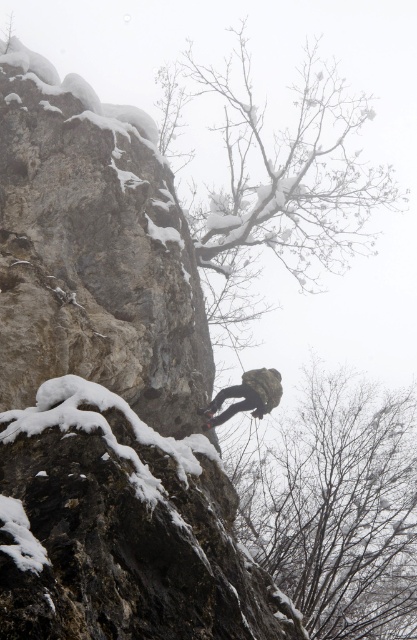
What do you see at coordinates (336, 508) in the screenshot? The height and width of the screenshot is (640, 417). I see `bare branches at center` at bounding box center [336, 508].

Is bare branches at center to the left of snow-covered branches at upper center from the viewer's perspective?

Incorrect, bare branches at center is not on the left side of snow-covered branches at upper center.

Does point (391, 500) lie behind point (168, 125)?

No, it is in front of (168, 125).

Find the location of a particular element. Image resolution: width=417 pixels, height=640 pixels. bare branches at center is located at coordinates (336, 508).

Does snow-covered branches at upper center come behind camouflage fabric rock climber at center?

Yes, it is.

Is snow-covered branches at upper center taller than camouflage fabric rock climber at center?

Yes.

Between point (321, 108) and point (258, 381), which one is positioned behind?

Point (321, 108)

Find the location of a particular element. This screenshot has height=640, width=417. snow-covered branches at upper center is located at coordinates (276, 179).

Which is behind, point (339, 381) or point (216, 404)?

Point (339, 381)

Does bare branches at center appear on the right side of camouflage fabric rock climber at center?

Indeed, bare branches at center is positioned on the right side of camouflage fabric rock climber at center.

Is point (379, 483) less distant than point (278, 390)?

No, it is behind (278, 390).

Locate an element on the screen. The image size is (417, 640). bare branches at center is located at coordinates (336, 508).